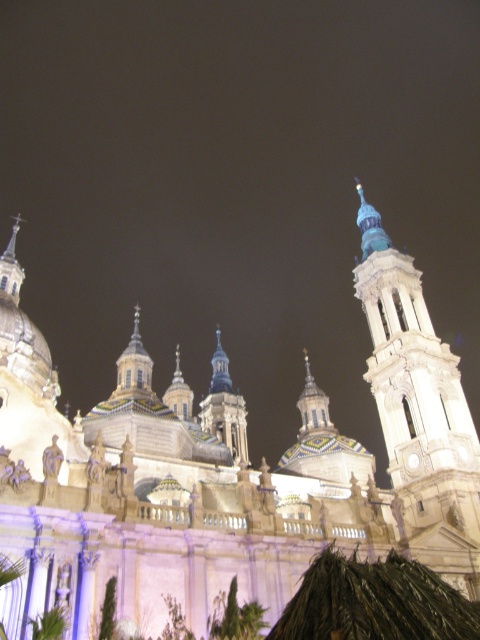
Question: In this image, where is white stone tower at right located relative to blue glass dome at center?

Choices:
 (A) below
 (B) above

Answer: (B)

Question: Which of the following is the farthest from the observer?

Choices:
 (A) blue glass dome at center
 (B) white stone tower at right
 (C) white stone church at center

Answer: (A)

Question: Can you confirm if white stone church at center is bigger than blue glass dome at center?

Choices:
 (A) yes
 (B) no

Answer: (A)

Question: Estimate the real-world distances between objects in this image. Which object is farther from the white stone church at center?

Choices:
 (A) white stone tower at right
 (B) blue glass dome at center

Answer: (B)

Question: Which point is farther to the camera?

Choices:
 (A) white stone tower at right
 (B) blue glass dome at center

Answer: (B)

Question: Can you confirm if white stone tower at right is smaller than blue glass dome at center?

Choices:
 (A) no
 (B) yes

Answer: (A)